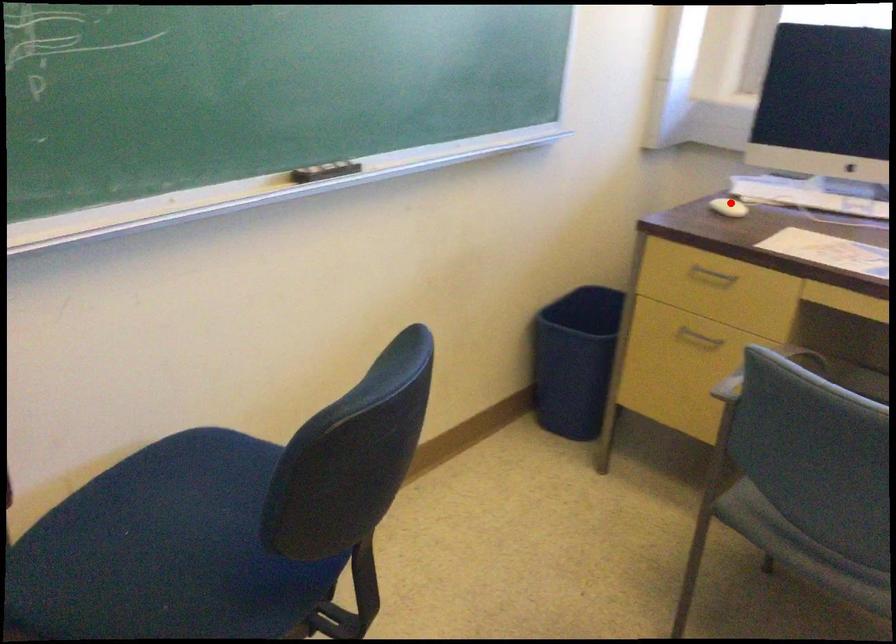
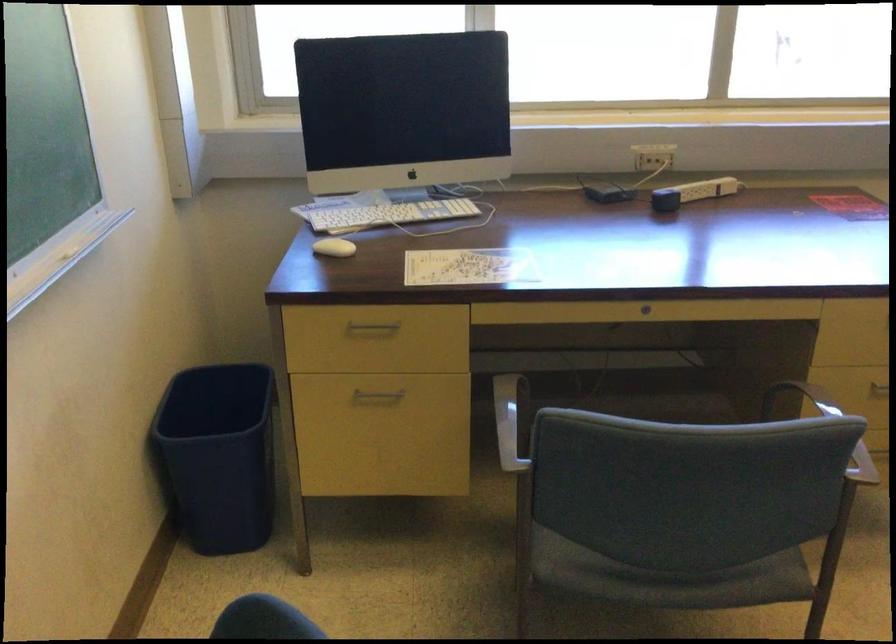
Question: I am providing you with two images of the same scene from different viewpoints. In image1, a red point is highlighted. Considering the same 3D point in image2, which of the following is correct?

Choices:
 (A) It is closer
 (B) It is farther

Answer: (A)